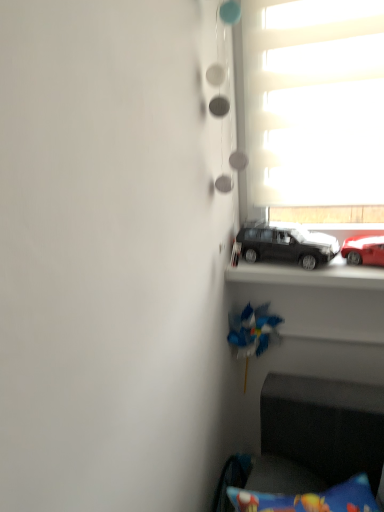
Question: From a real-world perspective, is shiny red car at right, the 1th car positioned from the right, beneath white matte window at upper right?

Choices:
 (A) no
 (B) yes

Answer: (B)

Question: Considering the relative sizes of shiny red car at right, the 1th car positioned from the right, and white matte window at upper right in the image provided, is shiny red car at right, the 1th car positioned from the right, shorter than white matte window at upper right?

Choices:
 (A) no
 (B) yes

Answer: (B)

Question: From a real-world perspective, is shiny red car at right, the 1th car positioned from the right, on top of white matte window at upper right?

Choices:
 (A) no
 (B) yes

Answer: (A)

Question: Is the depth of shiny red car at right, which is the second car in left-to-right order, greater than that of white matte window at upper right?

Choices:
 (A) no
 (B) yes

Answer: (A)

Question: Is shiny red car at right, the 1th car positioned from the right, bigger than white matte window at upper right?

Choices:
 (A) yes
 (B) no

Answer: (B)

Question: Is matte black car at center, the second car from the right, spatially inside blue plastic toy at center, or outside of it?

Choices:
 (A) inside
 (B) outside

Answer: (B)

Question: Is matte black car at center, the second car from the right, wider or thinner than blue plastic toy at center?

Choices:
 (A) wide
 (B) thin

Answer: (A)

Question: Based on their positions, is matte black car at center, the 1th car in the left-to-right sequence, located to the left or right of blue plastic toy at center?

Choices:
 (A) left
 (B) right

Answer: (B)

Question: Is point (251, 262) closer or farther from the camera than point (251, 336)?

Choices:
 (A) closer
 (B) farther

Answer: (A)

Question: Is blue plastic toy at center bigger or smaller than shiny red car at right, which is the second car in left-to-right order?

Choices:
 (A) small
 (B) big

Answer: (B)

Question: From a real-world perspective, relative to shiny red car at right, the 1th car positioned from the right, is blue plastic toy at center vertically above or below?

Choices:
 (A) below
 (B) above

Answer: (A)

Question: Is blue plastic toy at center wider or thinner than shiny red car at right, which is the second car in left-to-right order?

Choices:
 (A) thin
 (B) wide

Answer: (A)

Question: In the image, is blue plastic toy at center on the left side or the right side of shiny red car at right, which is the second car in left-to-right order?

Choices:
 (A) left
 (B) right

Answer: (A)

Question: Does point (306, 56) appear closer or farther from the camera than point (274, 244)?

Choices:
 (A) farther
 (B) closer

Answer: (B)

Question: Is white matte window at upper right wider or thinner than matte black car at center, the second car from the right?

Choices:
 (A) wide
 (B) thin

Answer: (B)